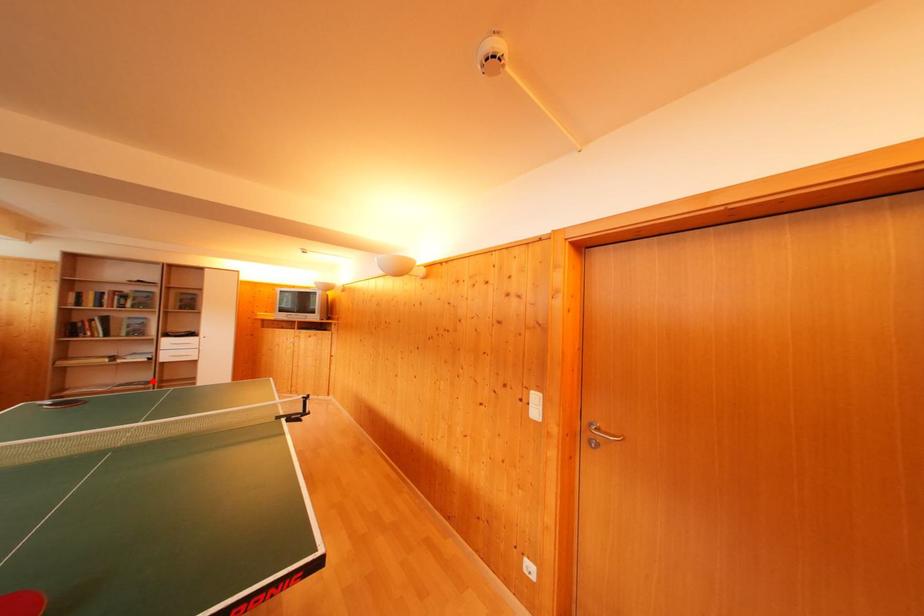
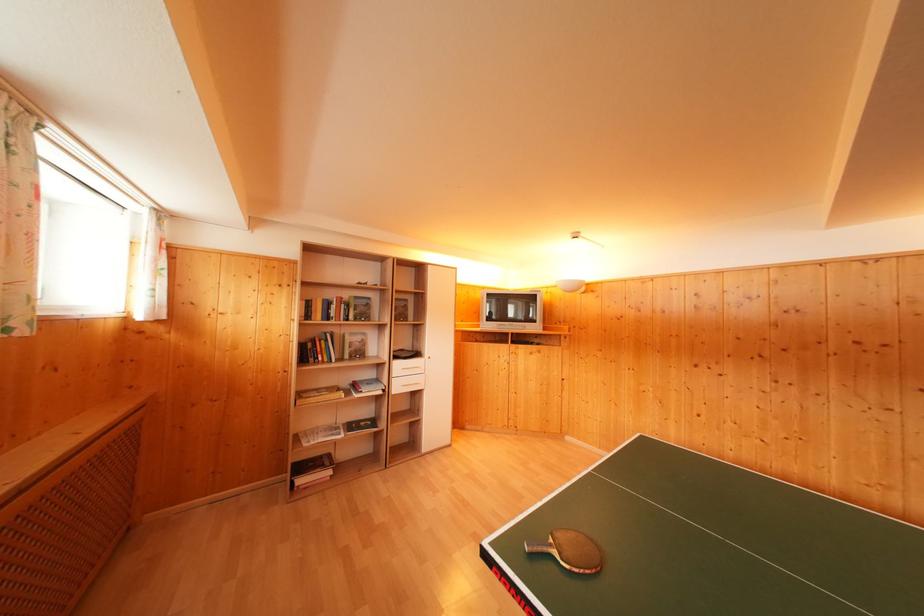
The point at the highlighted location is marked in the first image. Where is the corresponding point in the second image?

(371, 416)